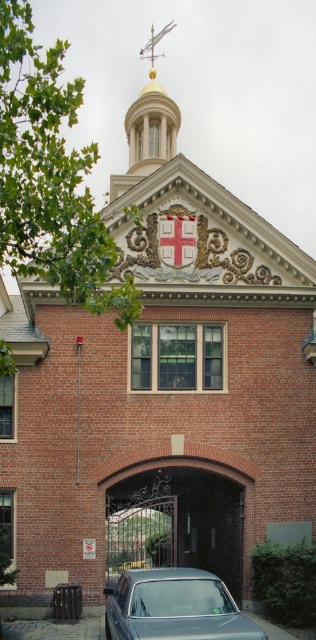
Question: Does metallic wrought iron gate at center appear over gold polished metal spire at upper center?

Choices:
 (A) no
 (B) yes

Answer: (A)

Question: Which is nearer to the gold polished metal spire at upper center?

Choices:
 (A) metallic wrought iron gate at center
 (B) metallic silver car at lower center

Answer: (A)

Question: Which point is farther from the camera taking this photo?

Choices:
 (A) (151, 156)
 (B) (131, 595)

Answer: (A)

Question: Considering the real-world distances, which object is closest to the metallic silver car at lower center?

Choices:
 (A) gold polished metal spire at upper center
 (B) metallic wrought iron gate at center

Answer: (B)

Question: Is metallic wrought iron gate at center closer to camera compared to gold polished metal spire at upper center?

Choices:
 (A) yes
 (B) no

Answer: (A)

Question: Where is metallic silver car at lower center located in relation to gold polished metal spire at upper center in the image?

Choices:
 (A) above
 (B) below

Answer: (B)